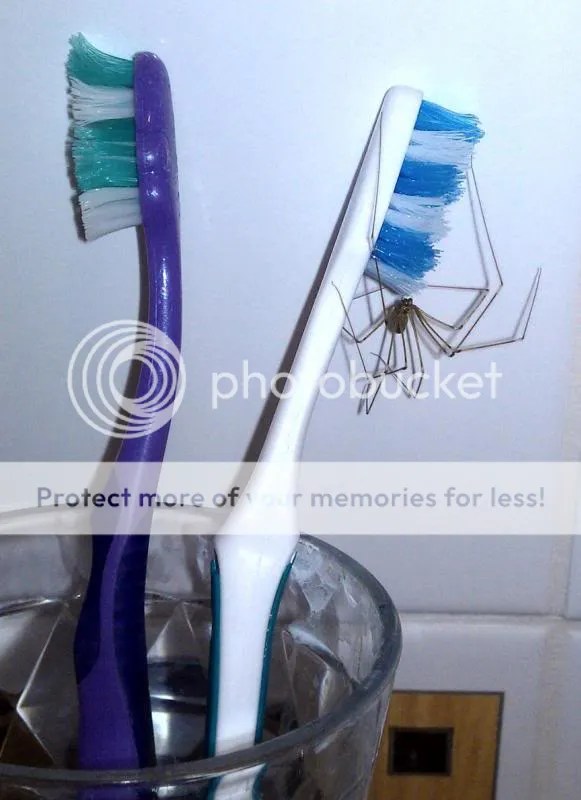
Locate an element on the screen. Image resolution: width=581 pixels, height=800 pixels. glass is located at coordinates (331, 742).